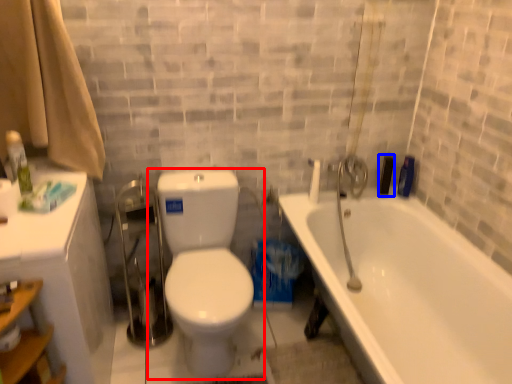
Question: Among these objects, which one is nearest to the camera, toilet (highlighted by a red box) or toiletry (highlighted by a blue box)?

Choices:
 (A) toilet
 (B) toiletry

Answer: (A)